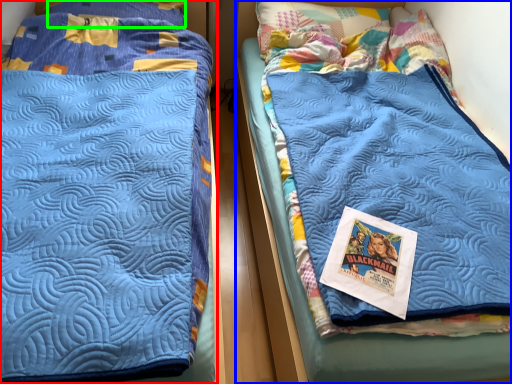
Question: Which object is the farthest from bed (highlighted by a red box)? Choose among these: bed (highlighted by a blue box) or pillow (highlighted by a green box).

Choices:
 (A) bed
 (B) pillow

Answer: (B)